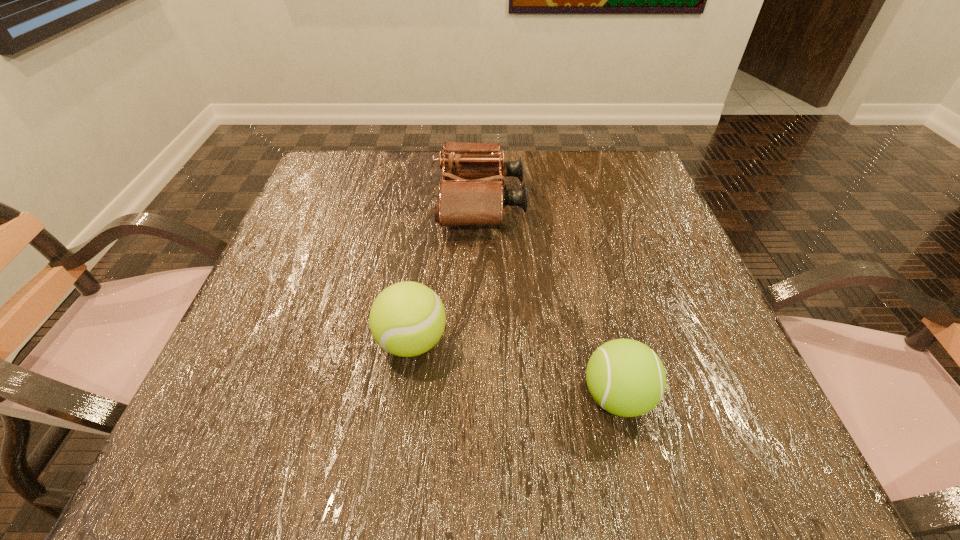
Locate an element on the screen. Image resolution: width=960 pixels, height=540 pixels. the farthest object is located at coordinates (470, 194).

Identify the location of the left tennis ball. This screenshot has width=960, height=540. (407, 319).

Locate an element on the screen. The image size is (960, 540). the rightmost object is located at coordinates (625, 377).

I want to click on vacant space located 0.240m through the eyepieces of the binoculars, so click(631, 202).

Where is `vacant space located 0.270m on the right of the left tennis ball`? The image size is (960, 540). vacant space located 0.270m on the right of the left tennis ball is located at coordinates (615, 342).

At what (x,y) coordinates should I click in order to perform the action: click on vacant space located on the right of the right tennis ball. Please return your answer as a coordinate pair (x, y). This screenshot has height=540, width=960. Looking at the image, I should click on (742, 397).

Locate an element on the screen. This screenshot has width=960, height=540. object located in the far edge section of the desktop is located at coordinates (470, 194).

Locate an element on the screen. The width and height of the screenshot is (960, 540). object positioned at the near edge is located at coordinates (625, 377).

Where is `object that is at the right edge`? The width and height of the screenshot is (960, 540). object that is at the right edge is located at coordinates [x=625, y=377].

Identify the location of object present at the near right corner. (625, 377).